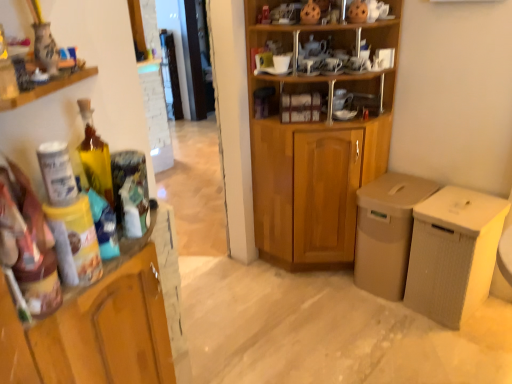
Question: Are matte ceramic vase at upper left and wooden cabinet at center making contact?

Choices:
 (A) no
 (B) yes

Answer: (A)

Question: Is matte ceramic vase at upper left closer to camera compared to wooden cabinet at center?

Choices:
 (A) yes
 (B) no

Answer: (A)

Question: From a real-world perspective, is matte ceramic vase at upper left physically below wooden cabinet at center?

Choices:
 (A) yes
 (B) no

Answer: (B)

Question: Can you confirm if matte ceramic vase at upper left is bigger than wooden cabinet at center?

Choices:
 (A) no
 (B) yes

Answer: (A)

Question: From the image's perspective, is matte ceramic vase at upper left below wooden cabinet at center?

Choices:
 (A) yes
 (B) no

Answer: (A)

Question: Considering the relative sizes of matte ceramic vase at upper left and wooden cabinet at center in the image provided, is matte ceramic vase at upper left shorter than wooden cabinet at center?

Choices:
 (A) no
 (B) yes

Answer: (A)

Question: From a real-world perspective, is wooden cupboard at center physically above translucent glass bottle at left?

Choices:
 (A) no
 (B) yes

Answer: (A)

Question: Is wooden cupboard at center positioned beyond the bounds of translucent glass bottle at left?

Choices:
 (A) no
 (B) yes

Answer: (B)

Question: Is wooden cupboard at center further to the viewer compared to translucent glass bottle at left?

Choices:
 (A) yes
 (B) no

Answer: (A)

Question: Is wooden cupboard at center to the right of translucent glass bottle at left from the viewer's perspective?

Choices:
 (A) no
 (B) yes

Answer: (B)

Question: Can you confirm if wooden cupboard at center is bigger than translucent glass bottle at left?

Choices:
 (A) yes
 (B) no

Answer: (A)

Question: From a real-world perspective, is wooden cupboard at center positioned under translucent glass bottle at left based on gravity?

Choices:
 (A) yes
 (B) no

Answer: (A)

Question: Would you say translucent glass bottle at left is a long distance from wooden cabinet at center?

Choices:
 (A) no
 (B) yes

Answer: (B)